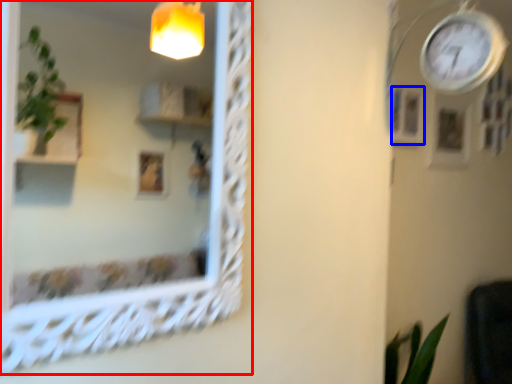
Question: Which point is further to the camera, mirror (highlighted by a red box) or picture frame (highlighted by a blue box)?

Choices:
 (A) mirror
 (B) picture frame

Answer: (B)